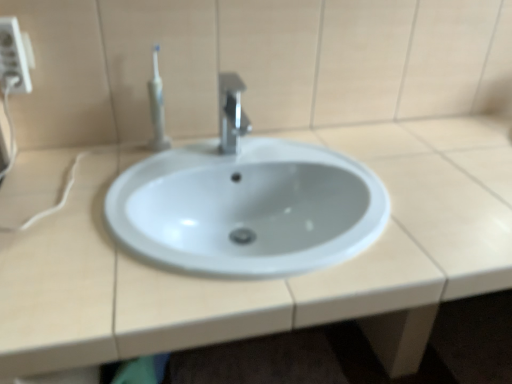
Question: Is white plastic electric outlet at upper left directly adjacent to white plastic toothbrush at upper left?

Choices:
 (A) no
 (B) yes

Answer: (A)

Question: From a real-world perspective, is white plastic electric outlet at upper left over white plastic toothbrush at upper left?

Choices:
 (A) no
 (B) yes

Answer: (B)

Question: Can you confirm if white plastic electric outlet at upper left is bigger than white plastic toothbrush at upper left?

Choices:
 (A) yes
 (B) no

Answer: (B)

Question: From the image's perspective, does white plastic electric outlet at upper left appear lower than white plastic toothbrush at upper left?

Choices:
 (A) no
 (B) yes

Answer: (A)

Question: Is the position of white plastic electric outlet at upper left less distant than that of white plastic toothbrush at upper left?

Choices:
 (A) no
 (B) yes

Answer: (B)

Question: Considering the positions of point (138, 332) and point (229, 79), is point (138, 332) closer or farther from the camera than point (229, 79)?

Choices:
 (A) closer
 (B) farther

Answer: (A)

Question: Is white glossy sink at center wider or thinner than polished metallic faucet at center?

Choices:
 (A) wide
 (B) thin

Answer: (A)

Question: Do you think white glossy sink at center is within polished metallic faucet at center, or outside of it?

Choices:
 (A) outside
 (B) inside

Answer: (A)

Question: Visually, is white glossy sink at center positioned to the left or to the right of polished metallic faucet at center?

Choices:
 (A) left
 (B) right

Answer: (B)

Question: From the image's perspective, is polished metallic faucet at center above or below white plastic toothbrush at upper left?

Choices:
 (A) above
 (B) below

Answer: (B)

Question: Is polished metallic faucet at center inside the boundaries of white plastic toothbrush at upper left, or outside?

Choices:
 (A) outside
 (B) inside

Answer: (A)

Question: In the image, is polished metallic faucet at center on the left side or the right side of white plastic toothbrush at upper left?

Choices:
 (A) right
 (B) left

Answer: (A)

Question: Considering the positions of polished metallic faucet at center and white plastic toothbrush at upper left in the image, is polished metallic faucet at center taller or shorter than white plastic toothbrush at upper left?

Choices:
 (A) tall
 (B) short

Answer: (B)

Question: Is point (4, 360) positioned closer to the camera than point (14, 81)?

Choices:
 (A) closer
 (B) farther

Answer: (A)

Question: In terms of size, does white glossy sink at center appear bigger or smaller than white plastic electric outlet at upper left?

Choices:
 (A) small
 (B) big

Answer: (B)